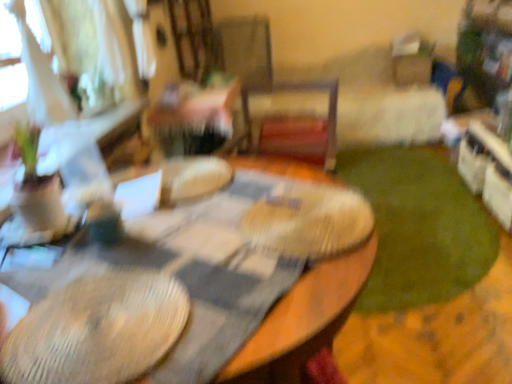
Find the location of a particular element. The height and width of the screenshot is (384, 512). green plush carpet at lower right is located at coordinates (419, 227).

Describe the element at coordinates (419, 227) in the screenshot. The height and width of the screenshot is (384, 512). I see `green plush carpet at lower right` at that location.

I want to click on wooden table at center, so click(303, 320).

The image size is (512, 384). Describe the element at coordinates (303, 320) in the screenshot. I see `wooden table at center` at that location.

In order to click on green plush carpet at lower right in this screenshot , I will do `click(419, 227)`.

Is wooden table at center at the right side of green plush carpet at lower right?

No.

Between wooden table at center and green plush carpet at lower right, which one is positioned in front?

wooden table at center is closer to the camera.

Which is closer to the camera, (275, 164) or (403, 158)?

Point (275, 164)

From the image's perspective, which one is positioned lower, wooden table at center or green plush carpet at lower right?

wooden table at center.

From a real-world perspective, is wooden table at center positioned above or below green plush carpet at lower right?

wooden table at center is above green plush carpet at lower right.

Looking at this image, does wooden table at center have a greater width compared to green plush carpet at lower right?

No, wooden table at center is not wider than green plush carpet at lower right.

Which of these two, wooden table at center or green plush carpet at lower right, stands taller?

Standing taller between the two is wooden table at center.

Is wooden table at center bigger or smaller than green plush carpet at lower right?

Clearly, wooden table at center is larger in size than green plush carpet at lower right.

Is wooden table at center located outside green plush carpet at lower right?

wooden table at center lies outside green plush carpet at lower right's area.

Is there a large distance between wooden table at center and green plush carpet at lower right?

Indeed, wooden table at center is not near green plush carpet at lower right.

Does wooden table at center turn towards green plush carpet at lower right?

No, wooden table at center is not turned towards green plush carpet at lower right.

Locate an element on the screen. Image resolution: width=512 pixels, height=384 pixels. table lying below the green plush carpet at lower right (from the image's perspective) is located at coordinates (303, 320).

Which is more to the right, green plush carpet at lower right or wooden table at center?

green plush carpet at lower right is more to the right.

Between green plush carpet at lower right and wooden table at center, which one is positioned behind?

Positioned behind is green plush carpet at lower right.

Is point (409, 181) positioned after point (358, 287)?

Yes.

From the image's perspective, between green plush carpet at lower right and wooden table at center, who is located below?

wooden table at center appears lower in the image.

From a real-world perspective, is green plush carpet at lower right positioned above or below wooden table at center?

Result: Clearly, from a real-world perspective, green plush carpet at lower right is below wooden table at center.

Can you confirm if green plush carpet at lower right is wider than wooden table at center?

Yes, green plush carpet at lower right is wider than wooden table at center.

Considering the relative sizes of green plush carpet at lower right and wooden table at center in the image provided, is green plush carpet at lower right taller than wooden table at center?

No.

Is green plush carpet at lower right bigger than wooden table at center?

No.

Is green plush carpet at lower right inside the boundaries of wooden table at center, or outside?

The correct answer is: outside.

Can you see green plush carpet at lower right touching wooden table at center?

No.

Is green plush carpet at lower right looking in the opposite direction of wooden table at center?

No, green plush carpet at lower right's orientation is not away from wooden table at center.

I want to click on grass lying on the right of wooden table at center, so click(x=419, y=227).

Locate an element on the screen. grass below the wooden table at center (from a real-world perspective) is located at coordinates (419, 227).

This screenshot has width=512, height=384. What are the coordinates of `grass above the wooden table at center (from the image's perspective)` in the screenshot? It's located at (419, 227).